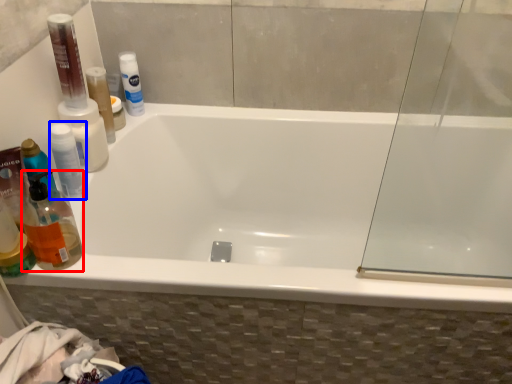
Question: Which of the following is the farthest to the observer, cleaning product (highlighted by a red box) or mouthwash (highlighted by a blue box)?

Choices:
 (A) cleaning product
 (B) mouthwash

Answer: (B)